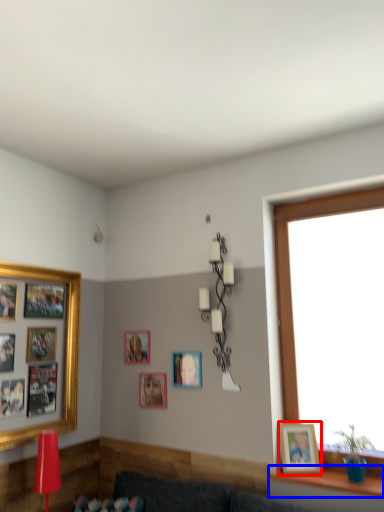
Question: Which object appears closest to the camera in this image, picture frame (highlighted by a red box) or window sill (highlighted by a blue box)?

Choices:
 (A) picture frame
 (B) window sill

Answer: (B)